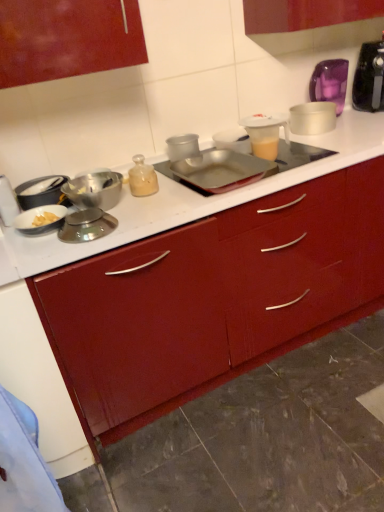
Describe the element at coordinates (312, 118) in the screenshot. I see `white plastic container at upper right, arranged as the first kitchen appliance when viewed from the right` at that location.

At what (x,y) coordinates should I click in order to perform the action: click on white plastic container at upper right, arranged as the first kitchen appliance when viewed from the right. Please return your answer as a coordinate pair (x, y). Image resolution: width=384 pixels, height=512 pixels. Looking at the image, I should click on (312, 118).

The image size is (384, 512). What do you see at coordinates (94, 190) in the screenshot?
I see `shiny silver bowl at left, marked as the 4th kitchen appliance in a left-to-right arrangement` at bounding box center [94, 190].

This screenshot has height=512, width=384. Describe the element at coordinates (369, 78) in the screenshot. I see `translucent plastic mixer at upper right` at that location.

Measure the distance between point [226,169] and camera.

A distance of 1.61 meters exists between point [226,169] and camera.

Where is `white plastic container at upper right, which ranks as the 7th kitchen appliance in left-to-right order`? white plastic container at upper right, which ranks as the 7th kitchen appliance in left-to-right order is located at coordinates (312, 118).

The image size is (384, 512). In the image, there is a translucent glass bottle at center. What are the coordinates of `counter below it (from the image's perspective)` in the screenshot? It's located at (121, 251).

Based on their positions, is translucent glass bottle at center located to the left or right of white glossy counter at center?

translucent glass bottle at center is positioned on white glossy counter at center's left side.

Is there a large distance between translucent glass bottle at center and white glossy counter at center?

No.

From a real-world perspective, is metallic silver bowl at left, placed as the first kitchen appliance when sorted from left to right, on metallic silver tray at center, placed as the sixth kitchen appliance when sorted from left to right?

Yes, from a real-world perspective, metallic silver bowl at left, placed as the first kitchen appliance when sorted from left to right, is over metallic silver tray at center, placed as the sixth kitchen appliance when sorted from left to right

Considering the relative positions of metallic silver bowl at left, placed as the first kitchen appliance when sorted from left to right, and metallic silver tray at center, the 2th kitchen appliance in the right-to-left sequence, in the image provided, is metallic silver bowl at left, placed as the first kitchen appliance when sorted from left to right, to the right of metallic silver tray at center, the 2th kitchen appliance in the right-to-left sequence, from the viewer's perspective?

No.

Is metallic silver bowl at left, placed as the first kitchen appliance when sorted from left to right, far away from metallic silver tray at center, the 2th kitchen appliance in the right-to-left sequence?

No, there isn't a large distance between metallic silver bowl at left, placed as the first kitchen appliance when sorted from left to right, and metallic silver tray at center, the 2th kitchen appliance in the right-to-left sequence.

Is translucent glass bottle at center not within matte silver bowl at left, which ranks as the second kitchen appliance in left-to-right order?

translucent glass bottle at center is positioned outside matte silver bowl at left, which ranks as the second kitchen appliance in left-to-right order.

How much distance is there between translucent glass bottle at center and matte silver bowl at left, acting as the sixth kitchen appliance starting from the right?

translucent glass bottle at center is 11.39 inches away from matte silver bowl at left, acting as the sixth kitchen appliance starting from the right.

Between translucent glass bottle at center and matte silver bowl at left, acting as the sixth kitchen appliance starting from the right, which one has larger size?

With larger size is matte silver bowl at left, acting as the sixth kitchen appliance starting from the right.

Does translucent glass bottle at center appear on the left side of matte silver bowl at left, which ranks as the second kitchen appliance in left-to-right order?

Incorrect, translucent glass bottle at center is not on the left side of matte silver bowl at left, which ranks as the second kitchen appliance in left-to-right order.

Looking at this image, is purple glass jar at upper right, the 2th appliance positioned from the front, at the back of translucent plastic mixer at upper right?

translucent plastic mixer at upper right is not turned away from purple glass jar at upper right, the 2th appliance positioned from the front.

Image resolution: width=384 pixels, height=512 pixels. I want to click on appliance that is the 1st object located below the translucent plastic mixer at upper right (from the image's perspective), so click(x=330, y=82).

In the scene shown: Between translucent plastic mixer at upper right and purple glass jar at upper right, the 1th appliance viewed from the right, which one has smaller size?

purple glass jar at upper right, the 1th appliance viewed from the right.

From the image's perspective, is translucent plastic mixer at upper right located above or below purple glass jar at upper right, the 1th appliance viewed from the right?

Clearly, from the image's perspective, translucent plastic mixer at upper right is above purple glass jar at upper right, the 1th appliance viewed from the right.

Find the location of a particular element. Image resolution: width=384 pixels, height=512 pixels. the 2nd kitchen appliance behind the white matte bowl at left, marked as the fifth kitchen appliance in a right-to-left arrangement is located at coordinates (217, 170).

Considering the positions of objects metallic silver tray at center, placed as the sixth kitchen appliance when sorted from left to right, and white matte bowl at left, which is the third kitchen appliance in left-to-right order, in the image provided, who is more to the left, metallic silver tray at center, placed as the sixth kitchen appliance when sorted from left to right, or white matte bowl at left, which is the third kitchen appliance in left-to-right order,?

Positioned to the left is white matte bowl at left, which is the third kitchen appliance in left-to-right order.

From the image's perspective, would you say metallic silver tray at center, the 2th kitchen appliance in the right-to-left sequence, is positioned over white matte bowl at left, which is the third kitchen appliance in left-to-right order?

Yes.

Which object is thinner, metallic silver tray at center, the 2th kitchen appliance in the right-to-left sequence, or white matte bowl at left, which is the third kitchen appliance in left-to-right order?

Thinner between the two is white matte bowl at left, which is the third kitchen appliance in left-to-right order.

From the picture: Is metallic silver scale at center-left, acting as the 5th kitchen appliance starting from the left, facing towards translucent glass bottle at center?

No, metallic silver scale at center-left, acting as the 5th kitchen appliance starting from the left, is not aimed at translucent glass bottle at center.

How many degrees apart are the facing directions of metallic silver scale at center-left, which is the 3th kitchen appliance from right to left, and translucent glass bottle at center?

The angle between the facing direction of metallic silver scale at center-left, which is the 3th kitchen appliance from right to left, and the facing direction of translucent glass bottle at center is 2.02 degrees.

Is metallic silver scale at center-left, which is the 3th kitchen appliance from right to left, taller or shorter than translucent glass bottle at center?

In the image, metallic silver scale at center-left, which is the 3th kitchen appliance from right to left, appears to be shorter than translucent glass bottle at center.

At what (x,y) coordinates should I click in order to perform the action: click on the 5th kitchen appliance below the translucent glass bottle at center (from the image's perspective). Please return your answer as a coordinate pair (x, y). This screenshot has height=512, width=384. Looking at the image, I should click on (87, 226).

Who is smaller, matte silver bowl at left, which ranks as the second kitchen appliance in left-to-right order, or translucent plastic measuring cup at upper center, which is the first appliance in left-to-right order?

translucent plastic measuring cup at upper center, which is the first appliance in left-to-right order.

Which object is closer to the camera taking this photo, matte silver bowl at left, which ranks as the second kitchen appliance in left-to-right order, or translucent plastic measuring cup at upper center, the 2th appliance positioned from the back?

Positioned in front is matte silver bowl at left, which ranks as the second kitchen appliance in left-to-right order.

Is matte silver bowl at left, which ranks as the second kitchen appliance in left-to-right order, not inside translucent plastic measuring cup at upper center, which is the first appliance in left-to-right order?

Indeed, matte silver bowl at left, which ranks as the second kitchen appliance in left-to-right order, is completely outside translucent plastic measuring cup at upper center, which is the first appliance in left-to-right order.

Which is in front, point (40, 201) or point (248, 131)?

The point (40, 201) is closer.

Identify the location of bottle above the white glossy counter at center (from a real-world perspective). This screenshot has height=512, width=384. (142, 178).

Which kitchen appliance is the 5th one when counting from the right side of the metallic silver bowl at left, placed as the first kitchen appliance when sorted from left to right? Please provide its 2D coordinates.

[(217, 170)]

Estimate the real-world distances between objects in this image. Which object is further from white matte bowl at left, which is the third kitchen appliance in left-to-right order, translucent plastic mixer at upper right or metallic silver scale at center-left, which is the 3th kitchen appliance from right to left?

The object further to white matte bowl at left, which is the third kitchen appliance in left-to-right order, is translucent plastic mixer at upper right.

In the scene shown: Based on their spatial positions, is metallic silver tray at center, the 2th kitchen appliance in the right-to-left sequence, or shiny silver bowl at left, the fourth kitchen appliance when ordered from right to left, further from white plastic container at upper right, which ranks as the 7th kitchen appliance in left-to-right order?

shiny silver bowl at left, the fourth kitchen appliance when ordered from right to left, is further to white plastic container at upper right, which ranks as the 7th kitchen appliance in left-to-right order.

Consider the image. Which object lies nearer to the anchor point translucent glass bottle at center, metallic silver bowl at left, arranged as the seventh kitchen appliance when viewed from the right, or white matte bowl at left, which is the third kitchen appliance in left-to-right order?

white matte bowl at left, which is the third kitchen appliance in left-to-right order, is positioned closer to the anchor translucent glass bottle at center.

Based on their spatial positions, is white matte bowl at left, which is the third kitchen appliance in left-to-right order, or metallic silver tray at center, placed as the sixth kitchen appliance when sorted from left to right, further from translucent glass bottle at center?

white matte bowl at left, which is the third kitchen appliance in left-to-right order, is further to translucent glass bottle at center.

Based on their spatial positions, is matte silver bowl at left, which ranks as the second kitchen appliance in left-to-right order, or translucent plastic mixer at upper right closer to white glossy counter at center?

The object closer to white glossy counter at center is matte silver bowl at left, which ranks as the second kitchen appliance in left-to-right order.

Looking at the image, which one is located closer to translucent plastic measuring cup at upper center, which is the first appliance from front to back, white glossy counter at center or white matte bowl at left, marked as the fifth kitchen appliance in a right-to-left arrangement?

Based on the image, white glossy counter at center appears to be nearer to translucent plastic measuring cup at upper center, which is the first appliance from front to back.

Considering their positions, is shiny silver bowl at left, the fourth kitchen appliance when ordered from right to left, positioned further to translucent plastic mixer at upper right than white glossy counter at center?

Among the two, shiny silver bowl at left, the fourth kitchen appliance when ordered from right to left, is located further to translucent plastic mixer at upper right.

Based on their spatial positions, is shiny silver bowl at left, marked as the 4th kitchen appliance in a left-to-right arrangement, or white plastic container at upper right, which ranks as the 7th kitchen appliance in left-to-right order, closer to translucent plastic mixer at upper right?

white plastic container at upper right, which ranks as the 7th kitchen appliance in left-to-right order, is closer to translucent plastic mixer at upper right.

Find the location of `kitchen appliance between translucent glass bottle at center and translucent plastic measuring cup at upper center, which is the first appliance from front to back, from left to right`. kitchen appliance between translucent glass bottle at center and translucent plastic measuring cup at upper center, which is the first appliance from front to back, from left to right is located at coordinates click(217, 170).

Where is `bottle between white glossy counter at center and translucent plastic measuring cup at upper center, which is the first appliance from front to back, in the front-back direction`? This screenshot has width=384, height=512. bottle between white glossy counter at center and translucent plastic measuring cup at upper center, which is the first appliance from front to back, in the front-back direction is located at coordinates (142, 178).

Identify the location of bottle situated between matte silver bowl at left, which ranks as the second kitchen appliance in left-to-right order, and metallic silver tray at center, the 2th kitchen appliance in the right-to-left sequence, from left to right. Image resolution: width=384 pixels, height=512 pixels. (142, 178).

The image size is (384, 512). What are the coordinates of `kitchen appliance between matte silver bowl at left, which ranks as the second kitchen appliance in left-to-right order, and shiny silver bowl at left, marked as the 4th kitchen appliance in a left-to-right arrangement` in the screenshot? It's located at (40, 219).